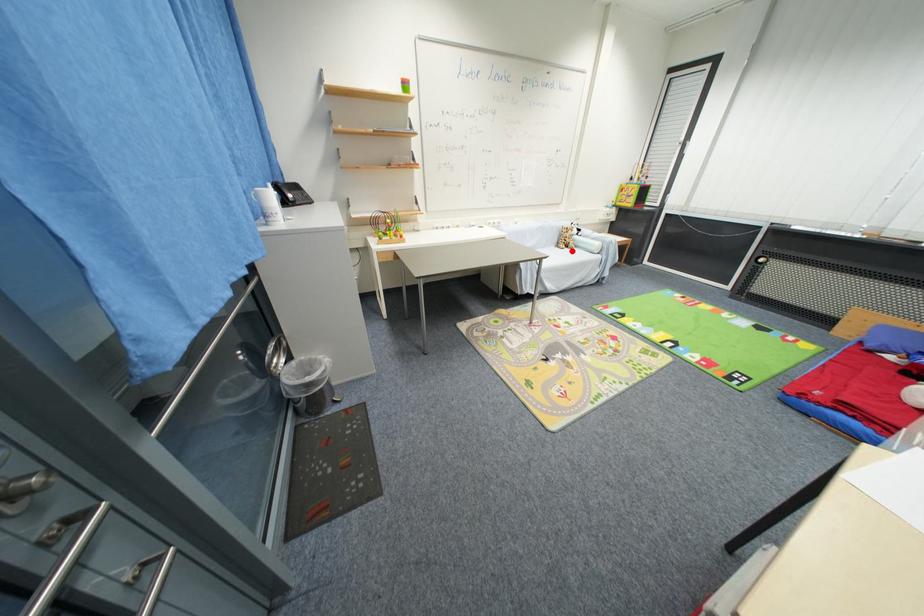
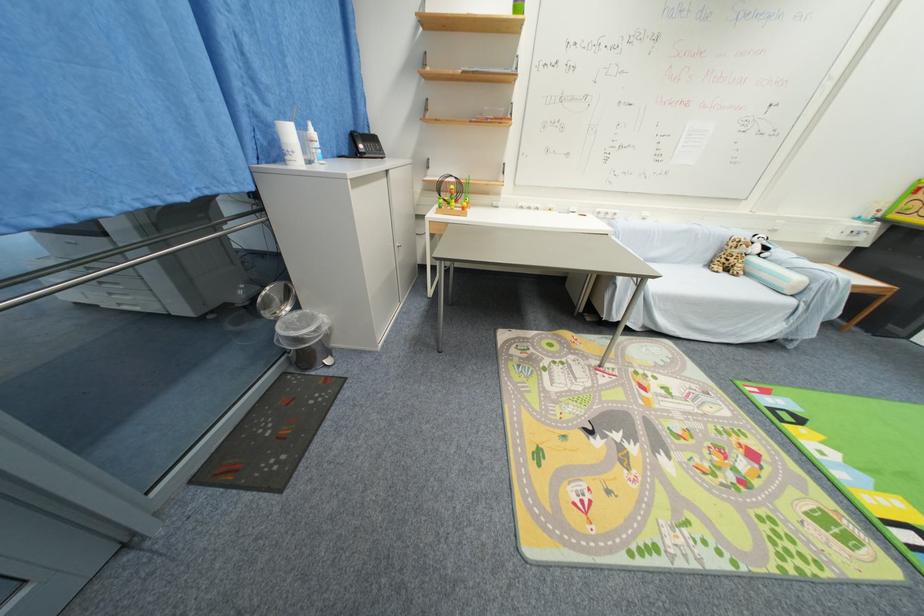
Find the pixel in the second image that matches the highlighted location in the first image.

(730, 276)